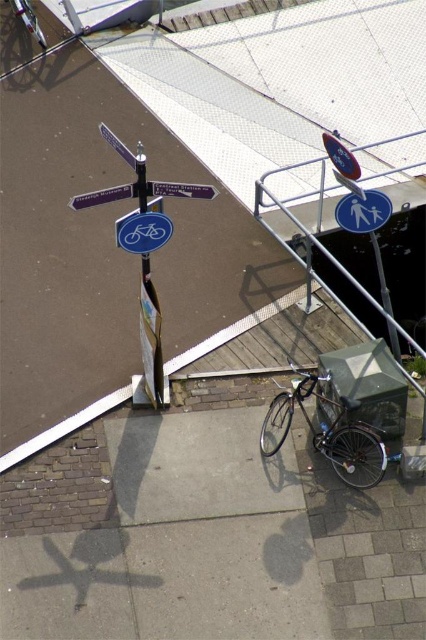
The image size is (426, 640). I want to click on matte purple signpost at upper left, so click(101, 196).

Does matte purple signpost at upper left have a greater height compared to blue plastic street sign at upper left?

No, matte purple signpost at upper left is not taller than blue plastic street sign at upper left.

Where is `matte purple signpost at upper left`? The image size is (426, 640). matte purple signpost at upper left is located at coordinates (101, 196).

Locate an element on the screen. This screenshot has height=640, width=426. matte purple signpost at upper left is located at coordinates (101, 196).

Does shiny metallic bicycle at center have a greater height compared to blue glossy bicycle sign at center?

Correct, shiny metallic bicycle at center is much taller as blue glossy bicycle sign at center.

Which of these two, shiny metallic bicycle at center or blue glossy bicycle sign at center, stands taller?

With more height is shiny metallic bicycle at center.

Is point (299, 396) more distant than point (147, 234)?

Yes, it is.

You are a GUI agent. You are given a task and a screenshot of the screen. Output one action in this format:
    pyautogui.click(x=<x>, y=<y>)
    Task: Click on the shiny metallic bicycle at center
    
    Given the screenshot: What is the action you would take?
    pyautogui.click(x=328, y=432)

Does metallic silver pole at center appear on the right side of blue plastic street sign at upper left?

Yes, metallic silver pole at center is to the right of blue plastic street sign at upper left.

Does metallic silver pole at center have a greater width compared to blue plastic street sign at upper left?

No.

Does point (143, 266) lie in front of point (108, 131)?

No, it is behind (108, 131).

Where is `metallic silver pole at center`? The width and height of the screenshot is (426, 640). metallic silver pole at center is located at coordinates (150, 337).